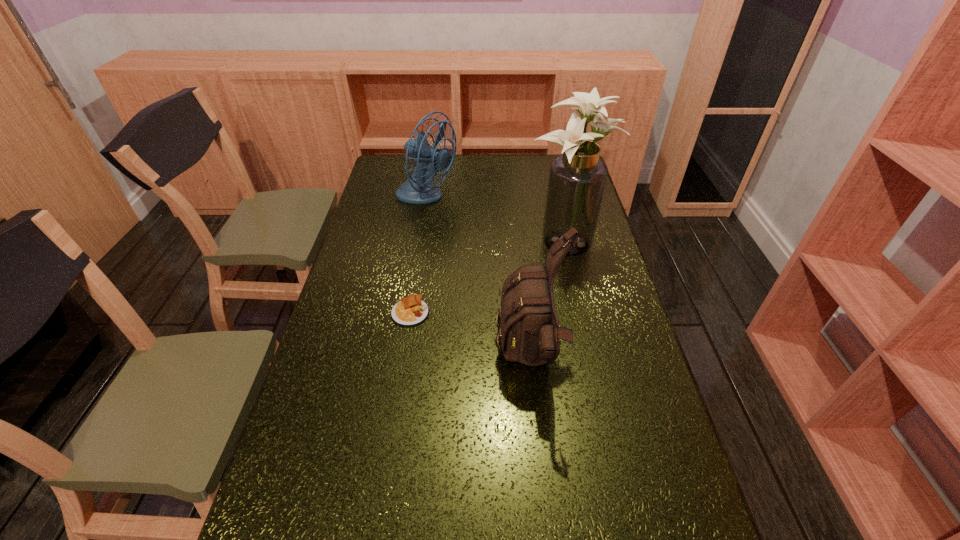
Find the location of a particular element. This screenshot has height=540, width=960. free location located 0.110m on the left of the shortest object is located at coordinates (354, 312).

I want to click on object present at the far edge, so click(415, 190).

At what (x,y) coordinates should I click in order to perform the action: click on object that is at the left edge. Please return your answer as a coordinate pair (x, y). Image resolution: width=960 pixels, height=540 pixels. Looking at the image, I should click on (415, 190).

Locate an element on the screen. object at the right edge is located at coordinates (577, 178).

Identify the location of object positioned at the far left corner. (415, 190).

In the image, there is a desktop. What are the coordinates of `vacant area at the far edge` in the screenshot? It's located at (514, 164).

The height and width of the screenshot is (540, 960). In order to click on vacant space at the left edge in this screenshot , I will do `click(347, 275)`.

Where is `vacant space at the right edge of the desktop`? vacant space at the right edge of the desktop is located at coordinates (605, 299).

This screenshot has width=960, height=540. Find the location of `free space at the far left corner of the desktop`. free space at the far left corner of the desktop is located at coordinates (400, 165).

Where is `blank space at the far right corner`? This screenshot has width=960, height=540. blank space at the far right corner is located at coordinates (546, 162).